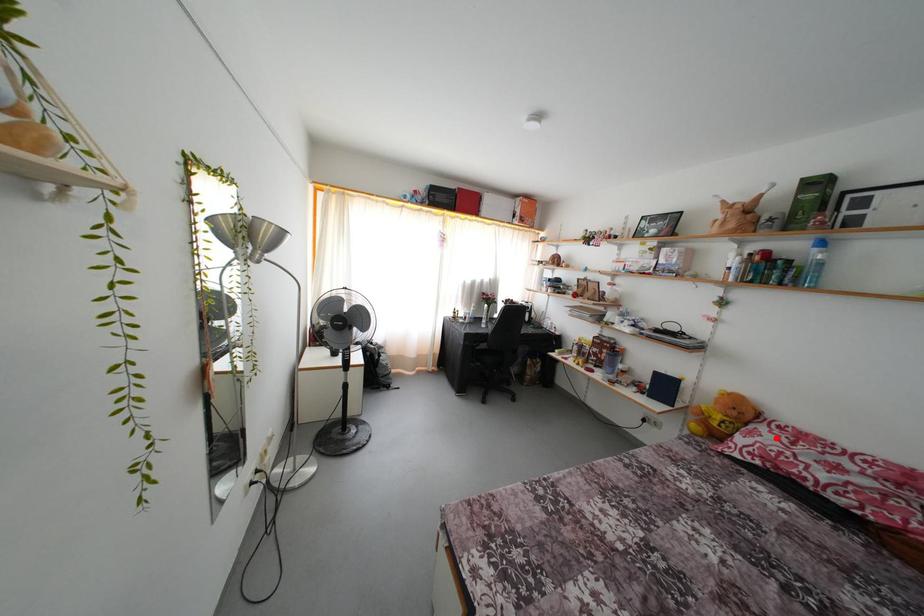
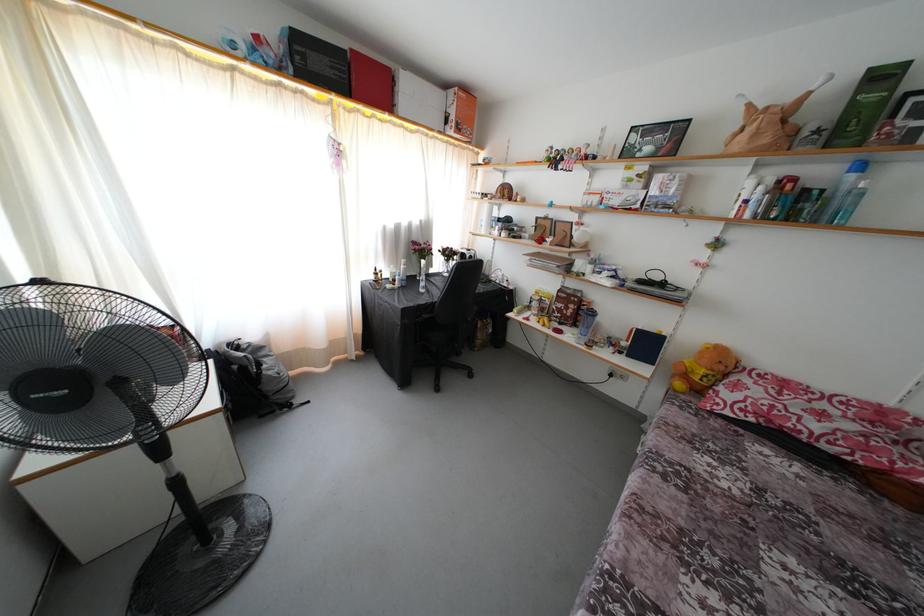
Question: I am providing you with two images of the same scene from different viewpoints. A red point is marked on the first image. Is the red point's position out of view in image 2?

Choices:
 (A) Yes
 (B) No

Answer: (B)